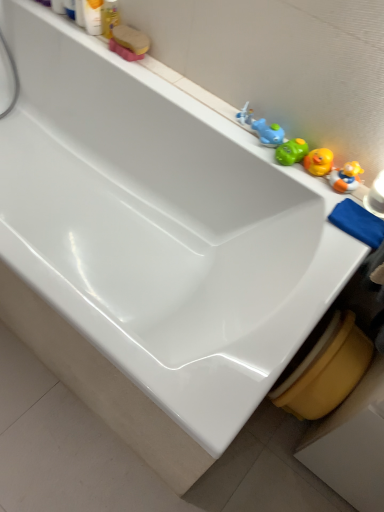
Where is `free space between white plastic toy at upper right, marked as the 2th toy in a top-to-bottom arrangement, and matte plastic soap at upper left, which is counted as the 1th toiletry, starting from the right`? This screenshot has height=512, width=384. free space between white plastic toy at upper right, marked as the 2th toy in a top-to-bottom arrangement, and matte plastic soap at upper left, which is counted as the 1th toiletry, starting from the right is located at coordinates (193, 87).